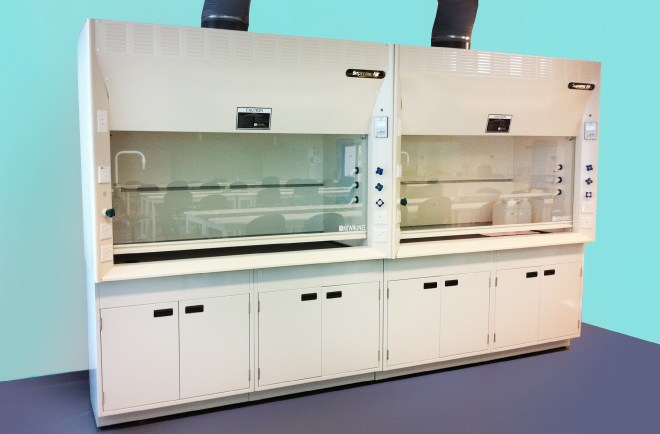
At what (x,y) coordinates should I click in order to perform the action: click on hinge. Please return your answer as a coordinate pair (x, y). This screenshot has height=434, width=660. Looking at the image, I should click on pos(259,373).